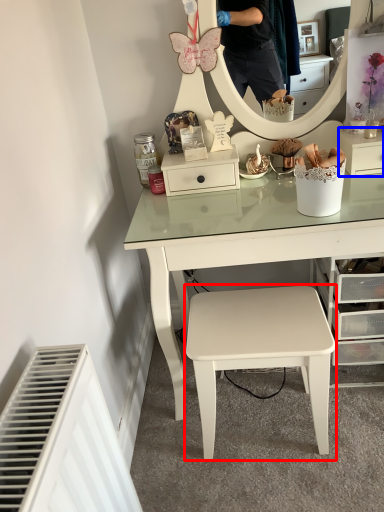
Question: Which object is further to the camera taking this photo, stool (highlighted by a red box) or shelf (highlighted by a blue box)?

Choices:
 (A) stool
 (B) shelf

Answer: (B)